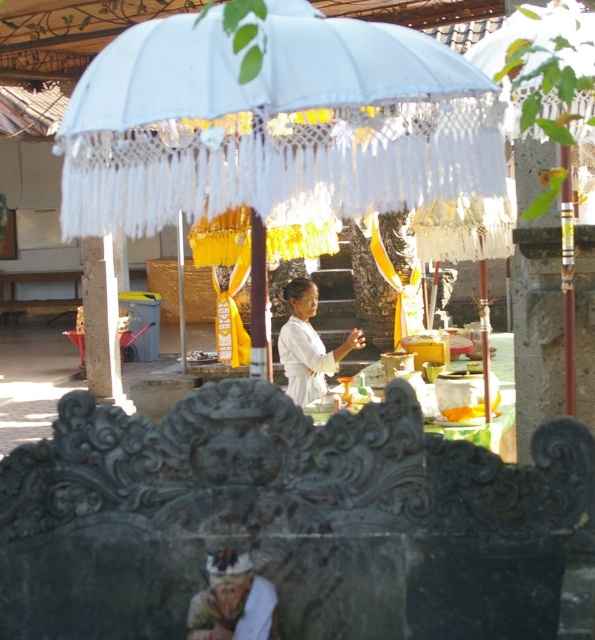
Is white lace umbrella at center wider than white matte/soft fabric woman at center?

Yes, white lace umbrella at center is wider than white matte/soft fabric woman at center.

Does white lace umbrella at center have a lesser width compared to white matte/soft fabric woman at center?

No.

Is point (486, 96) closer to camera compared to point (317, 291)?

Yes, point (486, 96) is in front of point (317, 291).

Locate an element on the screen. white lace umbrella at center is located at coordinates (273, 122).